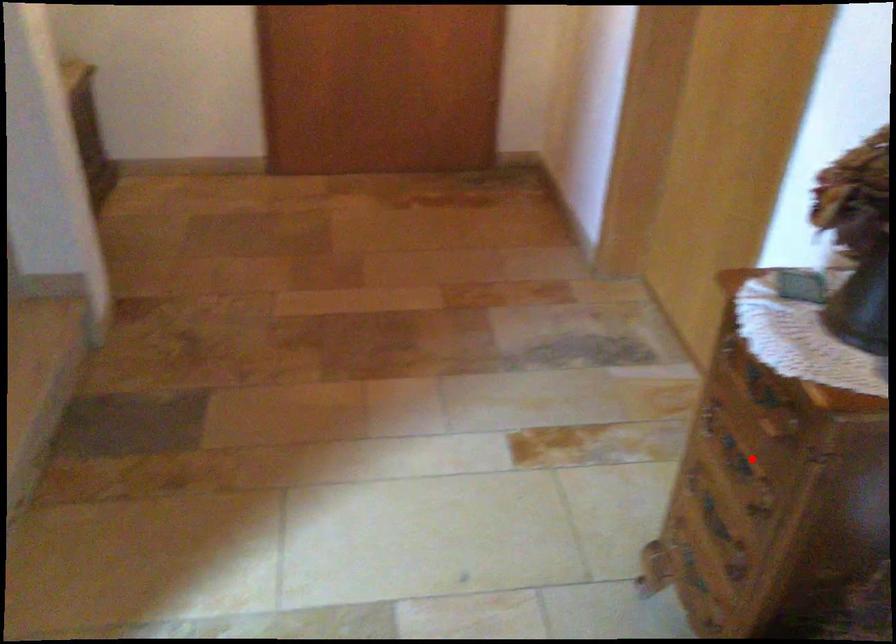
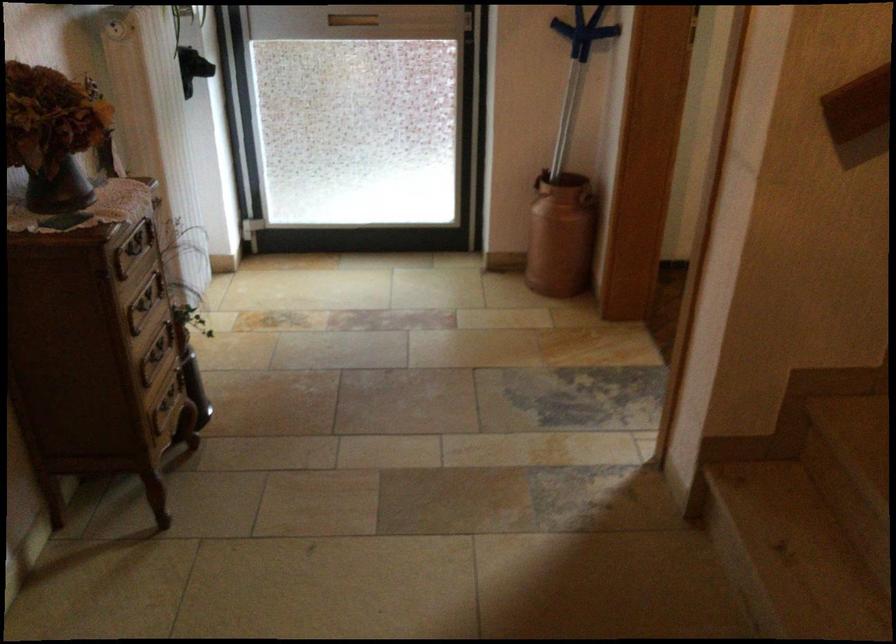
Find the pixel in the second image that matches the highlighted location in the first image.

(144, 303)